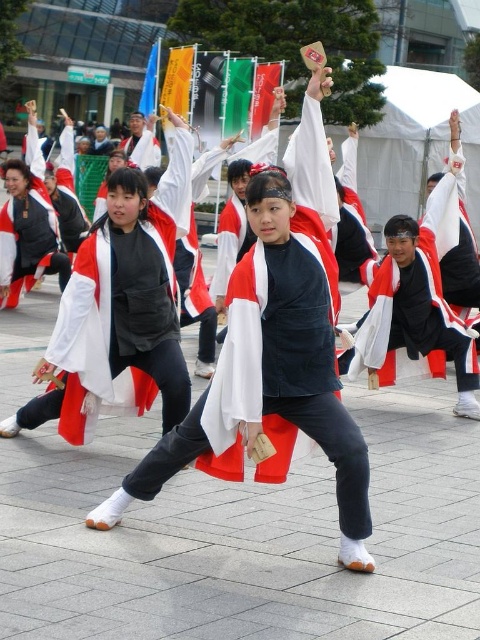
Is point (301, 150) positioned before point (152, 300)?

Yes, point (301, 150) is in front of point (152, 300).

Locate an element on the screen. The image size is (480, 640). matte black jacket at center is located at coordinates (276, 344).

Locate an element on the screen. This screenshot has height=640, width=480. matte black jacket at center is located at coordinates (276, 344).